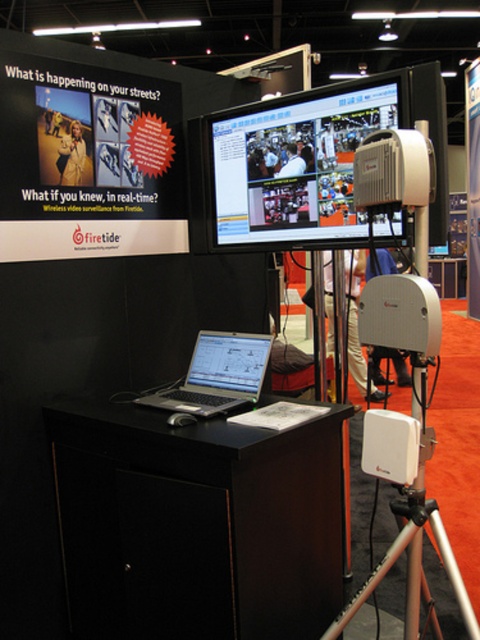
You are setting up a presentation at a trade show booth. You have a satin silver laptop at center and a white plastic projector at center. Where should you place the laptop relative to the projector to align with their current positions?

The satin silver laptop at center is below the white plastic projector at center, so you should place the laptop below the projector to maintain their current alignment.

You are setting up a portable workstation for a field operation. You have a satin silver laptop at center and a white plastic projector at center. Which object should you choose to carry if you need to prioritize space conservation?

The white plastic projector at center has a smaller width than the satin silver laptop at center, so it would be more space efficient to carry the white plastic projector at center.

You are setting up a presentation at the Firetide booth. You have a satin silver laptop at center and a white plastic projector at center. Where should you place the projector relative to the laptop to align with the current setup?

The satin silver laptop at center is positioned on the left side of the white plastic projector at center, so you should place the projector to the right of the laptop to align with the current setup.